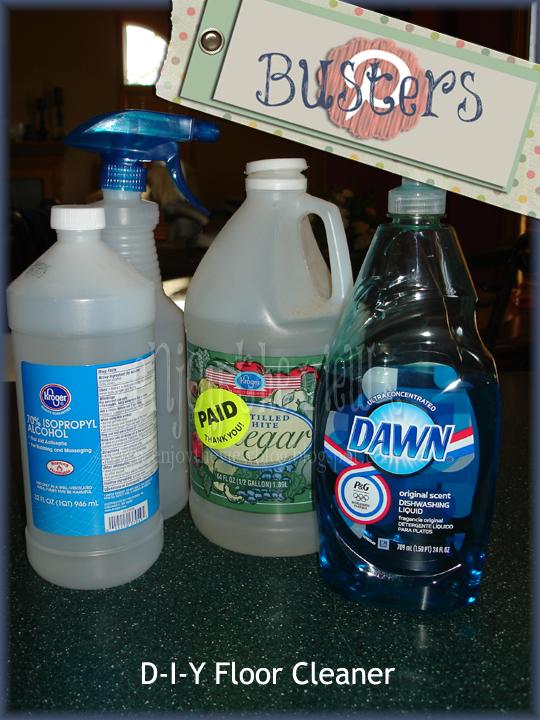
This screenshot has height=720, width=540. I want to click on counter, so click(x=479, y=631).